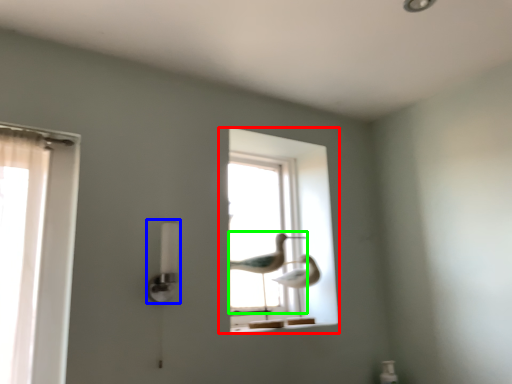
Question: Estimate the real-world distances between objects in this image. Which object is closer to window (highlighted by a red box), lamp (highlighted by a blue box) or bird (highlighted by a green box)?

Choices:
 (A) lamp
 (B) bird

Answer: (B)